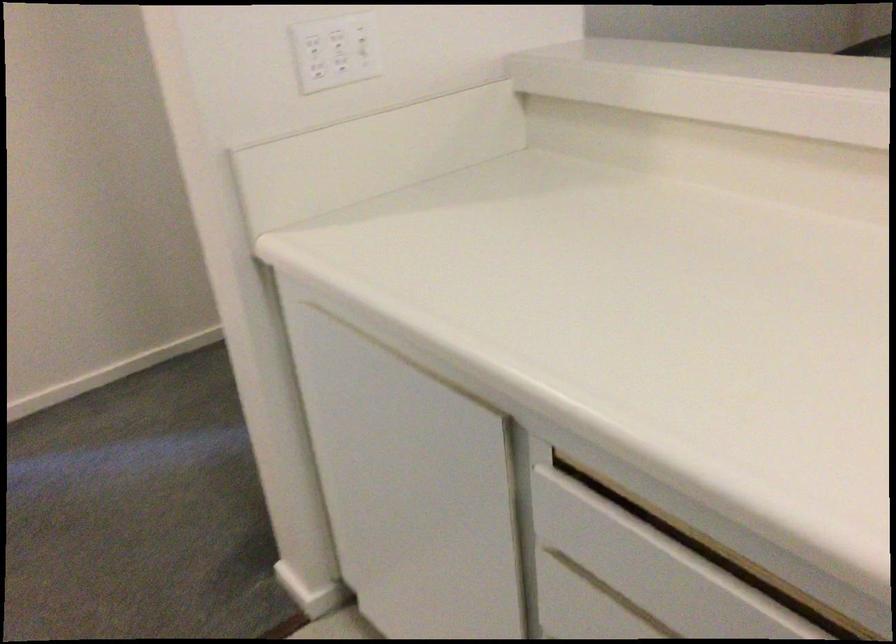
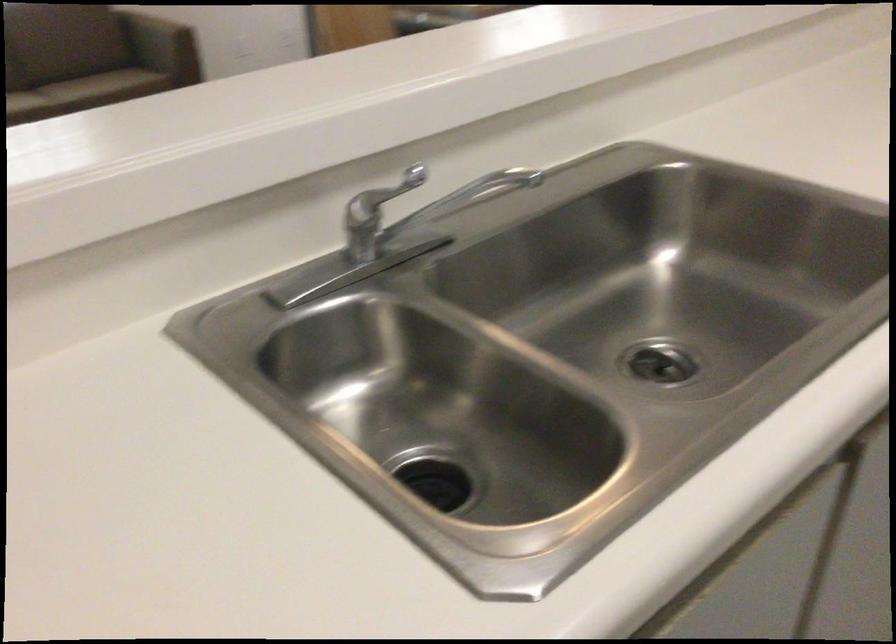
Based on the continuous images, in which direction is the camera rotating?

The camera rotated toward right-down.